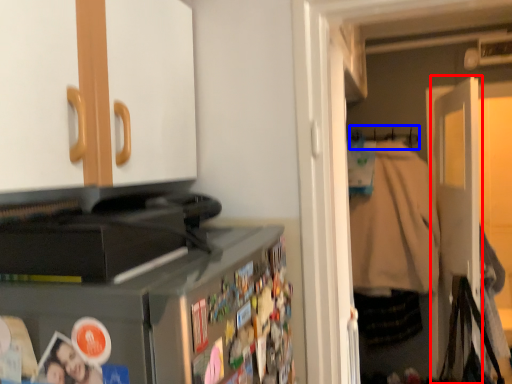
Question: Which object is closer to the camera taking this photo, door (highlighted by a red box) or hanger (highlighted by a blue box)?

Choices:
 (A) door
 (B) hanger

Answer: (A)